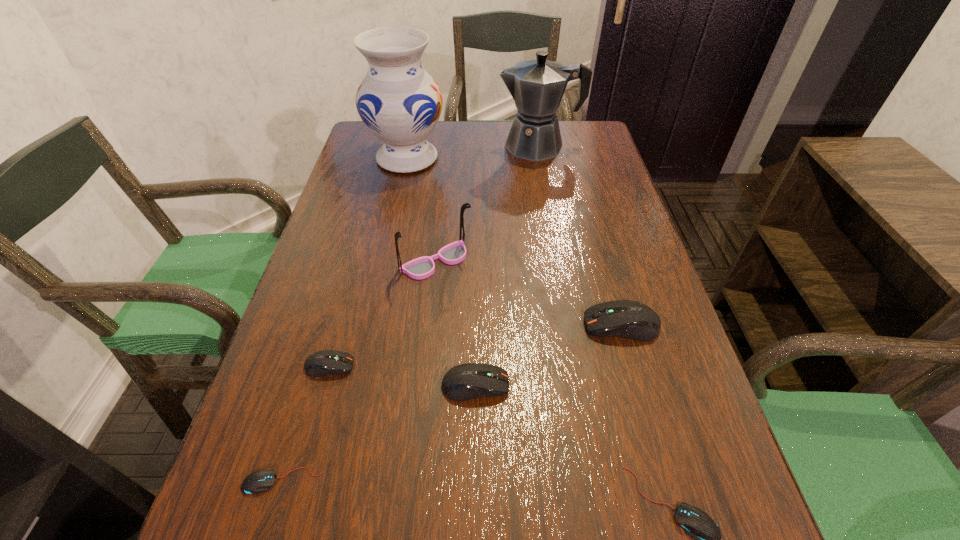
Find the location of a particular element. Image resolution: width=960 pixels, height=540 pixels. vacant region between the fifth shortest object and the vase is located at coordinates [515, 241].

You are a GUI agent. You are given a task and a screenshot of the screen. Output one action in this format:
    pyautogui.click(x=<x>, y=<y>)
    Task: Click on the object that is the fourth closest one to the sixth nearest object
    This screenshot has width=960, height=540.
    Given the screenshot: What is the action you would take?
    pyautogui.click(x=399, y=102)

Where is `object that is the sixth closest to the third mouse from right to left`? This screenshot has width=960, height=540. object that is the sixth closest to the third mouse from right to left is located at coordinates (399, 102).

This screenshot has height=540, width=960. I want to click on the fourth closest mouse to the biggest dark computer equipment, so click(262, 480).

Locate which mouse is the third closest to the farthest dark computer equipment. Please provide its 2D coordinates. Your answer should be formatted as a tuple, i.e. [(x, y)], where the tuple contains the x and y coordinates of a point satisfying the conditions above.

[(325, 362)]

Identify which dark computer equipment is the second closest to the third shortest mouse. Please provide its 2D coordinates. Your answer should be formatted as a tuple, i.e. [(x, y)], where the tuple contains the x and y coordinates of a point satisfying the conditions above.

[(629, 319)]

This screenshot has width=960, height=540. In order to click on the second closest dark computer equipment to the seventh shortest object in this screenshot , I will do `click(467, 381)`.

Locate an element on the screen. This screenshot has height=540, width=960. the closest black mouse relative to the rightmost dark computer equipment is located at coordinates (698, 525).

I want to click on black mouse that can be found as the second closest to the fourth farthest object, so click(262, 480).

Identify the location of free space that satisfies the following two spatial constraints: 1. at the spout of the coffeepot; 2. on the front side of the tallest object. (540, 158).